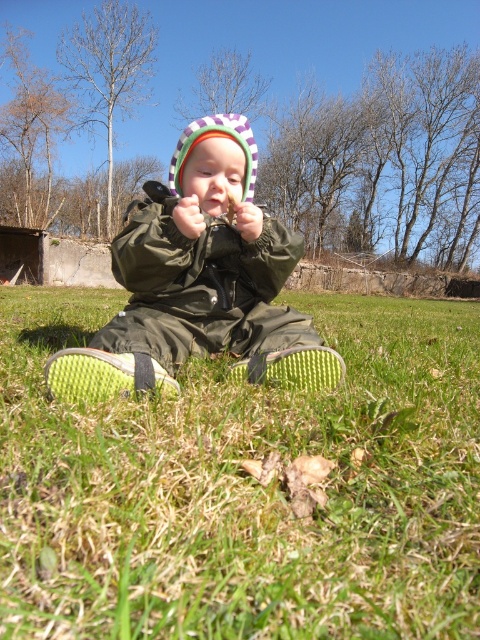
Is green grass at lower center to the left of green rubber boots at center from the viewer's perspective?

Incorrect, green grass at lower center is not on the left side of green rubber boots at center.

This screenshot has width=480, height=640. What do you see at coordinates (243, 486) in the screenshot?
I see `green grass at lower center` at bounding box center [243, 486].

Where is `green grass at lower center`? This screenshot has height=640, width=480. green grass at lower center is located at coordinates (243, 486).

Find the location of `green grass at lower center`. green grass at lower center is located at coordinates (x=243, y=486).

In the scene shown: Is green rubber boots at center to the right of green rubber shoe at lower left from the viewer's perspective?

Correct, you'll find green rubber boots at center to the right of green rubber shoe at lower left.

Between green rubber boots at center and green rubber shoe at lower left, which one has less height?

Standing shorter between the two is green rubber shoe at lower left.

Locate an element on the screen. green rubber boots at center is located at coordinates (200, 282).

Is green rubber shoe at lower left behind green textured shoe at lower center?

No, it is in front of green textured shoe at lower center.

Between point (152, 380) and point (305, 378), which one is positioned in front?

Point (152, 380) is more forward.

Locate an element on the screen. The height and width of the screenshot is (640, 480). green rubber shoe at lower left is located at coordinates (104, 376).

This screenshot has height=640, width=480. I want to click on green rubber shoe at lower left, so click(x=104, y=376).